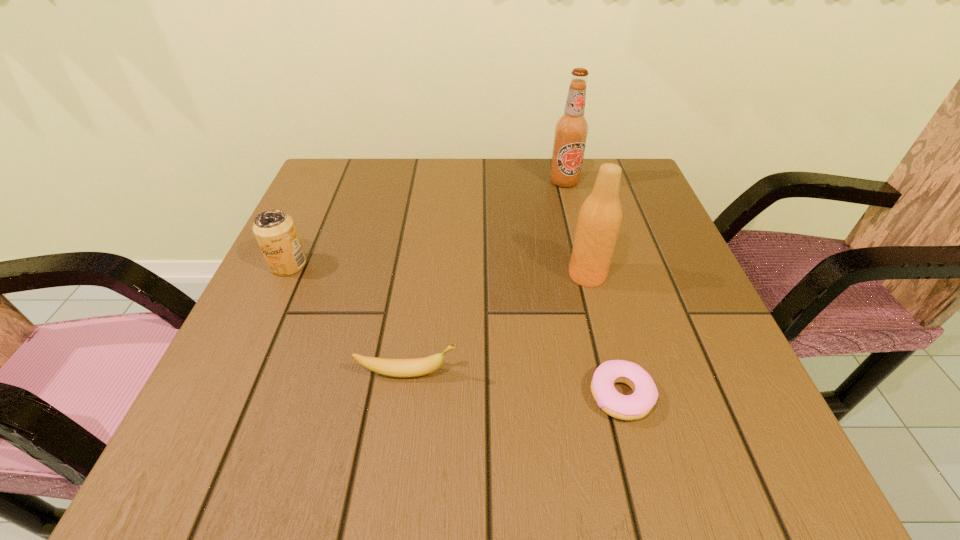
In the image, there is a desktop. Identify the location of blank space at the right edge. (627, 305).

The height and width of the screenshot is (540, 960). I want to click on vacant space at the far left corner of the desktop, so click(x=340, y=177).

Find the location of `free space at the near right corner of the desktop`. free space at the near right corner of the desktop is located at coordinates (690, 430).

Where is `free point between the shortest object and the nearer beer bottle`? The width and height of the screenshot is (960, 540). free point between the shortest object and the nearer beer bottle is located at coordinates (604, 335).

At what (x,y) coordinates should I click in order to perform the action: click on free space between the beer can and the nearer beer bottle. Please return your answer as a coordinate pair (x, y). This screenshot has width=960, height=540. Looking at the image, I should click on (438, 270).

Where is `free space between the shortest object and the nearer beer bottle`? free space between the shortest object and the nearer beer bottle is located at coordinates (604, 335).

You are a GUI agent. You are given a task and a screenshot of the screen. Output one action in this format:
    pyautogui.click(x=<x>, y=<y>)
    Task: Click on the free space between the doughnut and the leftmost object
    The image size is (960, 540).
    Given the screenshot: What is the action you would take?
    pyautogui.click(x=455, y=330)

Locate an element on the screen. The height and width of the screenshot is (540, 960). free space between the third shortest object and the shortest object is located at coordinates (455, 330).

Identify the location of unoccupied position between the doughnut and the farthest object. (592, 288).

Locate an element on the screen. The height and width of the screenshot is (540, 960). empty location between the doughnut and the leftmost object is located at coordinates (455, 330).